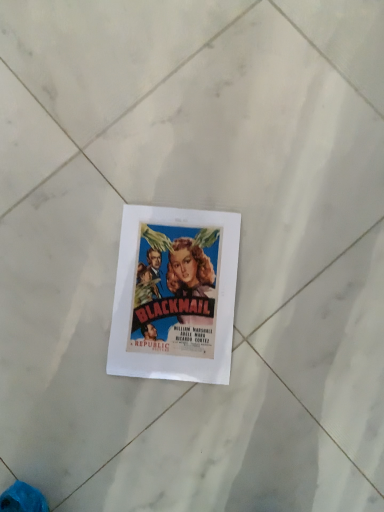
Image resolution: width=384 pixels, height=512 pixels. I want to click on empty space that is ontop of matte paper poster at center (from a real-world perspective), so click(x=178, y=288).